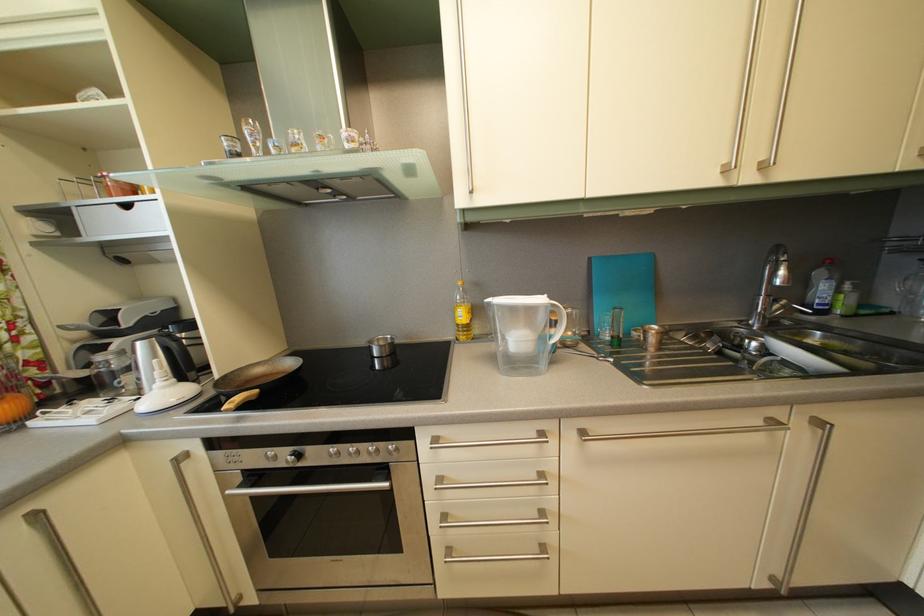
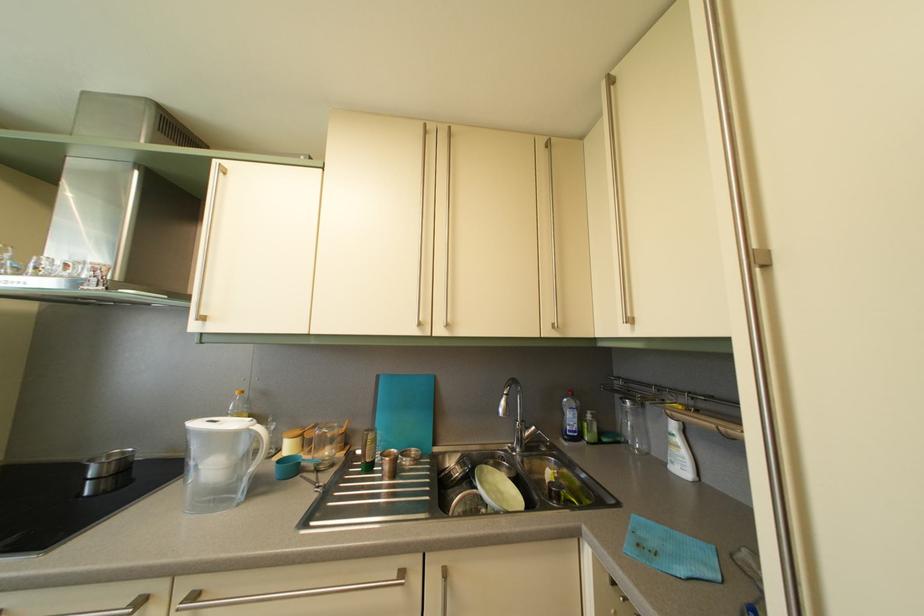
Locate, in the second image, the point that corresponds to (829,312) in the first image.

(578, 439)